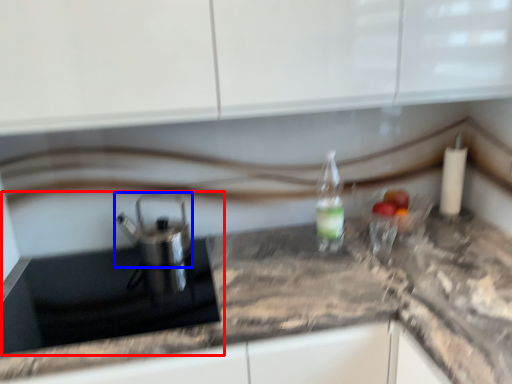
Question: Which of the following is the farthest to the observer, sink (highlighted by a red box) or tea pot (highlighted by a blue box)?

Choices:
 (A) sink
 (B) tea pot

Answer: (B)